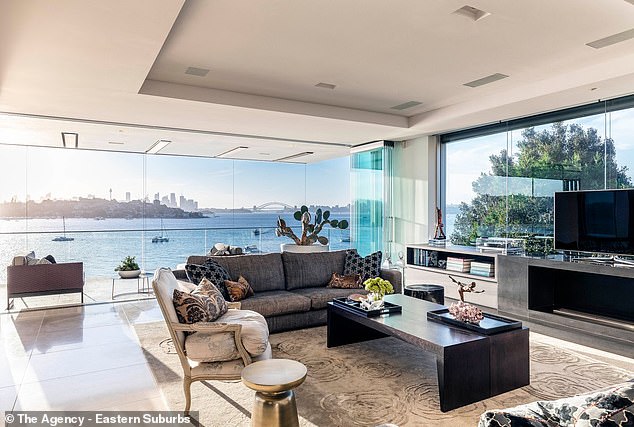
You are a GUI agent. You are given a task and a screenshot of the screen. Output one action in this format:
    pyautogui.click(x=<x>, y=<y>)
    Task: Click on the recessed light
    Image resolution: width=634 pixels, height=427 pixels.
    Given the screenshot: What is the action you would take?
    pyautogui.click(x=468, y=12)